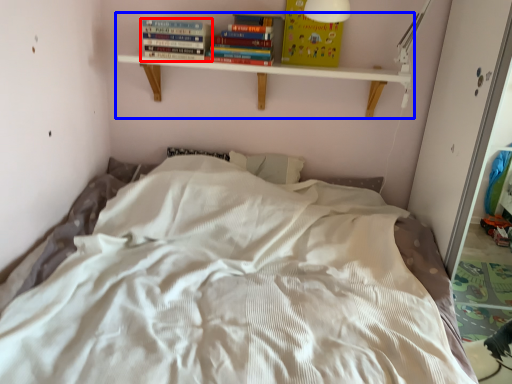
Question: Among these objects, which one is farthest to the camera, book (highlighted by a red box) or shelf (highlighted by a blue box)?

Choices:
 (A) book
 (B) shelf

Answer: (A)